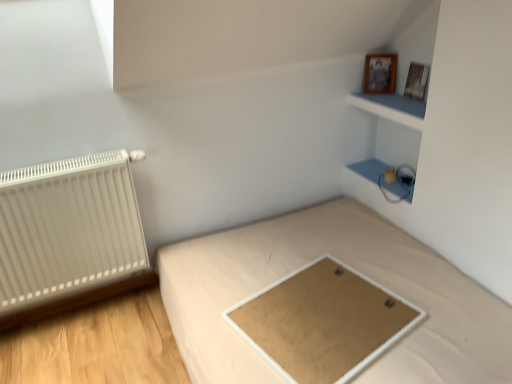
Identify the location of vacant area situated below blue matte cabinet at upper right, which is counted as the 2th cabinet, starting from the bottom (from a real-world perspective). (378, 170).